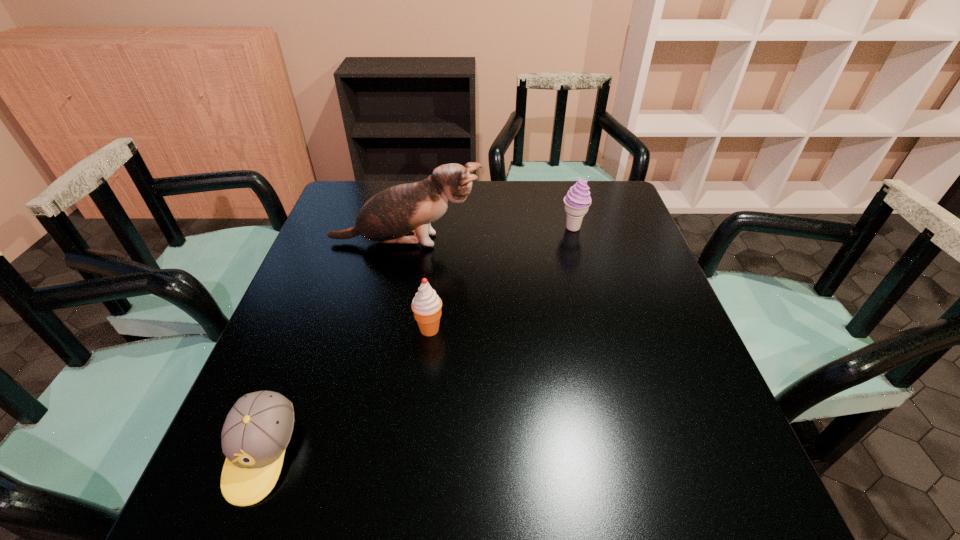
What are the coordinates of `vacant space that is in between the rightmost object and the left icecream` in the screenshot? It's located at (501, 279).

Image resolution: width=960 pixels, height=540 pixels. What are the coordinates of `free area in between the rightmost object and the left icecream` in the screenshot? It's located at (501, 279).

I want to click on object that ranks as the second closest to the third farthest object, so click(x=257, y=430).

Choose which object is the second nearest neighbor to the cat. Please provide its 2D coordinates. Your answer should be formatted as a tuple, i.e. [(x, y)], where the tuple contains the x and y coordinates of a point satisfying the conditions above.

[(426, 305)]

You are a GUI agent. You are given a task and a screenshot of the screen. Output one action in this format:
    pyautogui.click(x=<x>, y=<y>)
    Task: Click on the free space that satisfies the following two spatial constraints: 1. on the back side of the farther icecream; 2. on the right side of the nearer icecream
    This screenshot has width=960, height=540.
    Given the screenshot: What is the action you would take?
    pyautogui.click(x=441, y=228)

Image resolution: width=960 pixels, height=540 pixels. Identify the location of blank space that satisfies the following two spatial constraints: 1. on the back side of the farther icecream; 2. on the right side of the left icecream. (441, 228).

Identify the location of vacant area in the image that satisfies the following two spatial constraints: 1. at the face of the cat; 2. on the front-facing side of the shortest object. The height and width of the screenshot is (540, 960). (362, 454).

This screenshot has width=960, height=540. What are the coordinates of `free space that satisfies the following two spatial constraints: 1. at the face of the cat; 2. on the back side of the second nearest object` in the screenshot? It's located at (388, 329).

Identify the location of free space that satisfies the following two spatial constraints: 1. at the face of the tallest object; 2. on the front-facing side of the baseball cap. (362, 454).